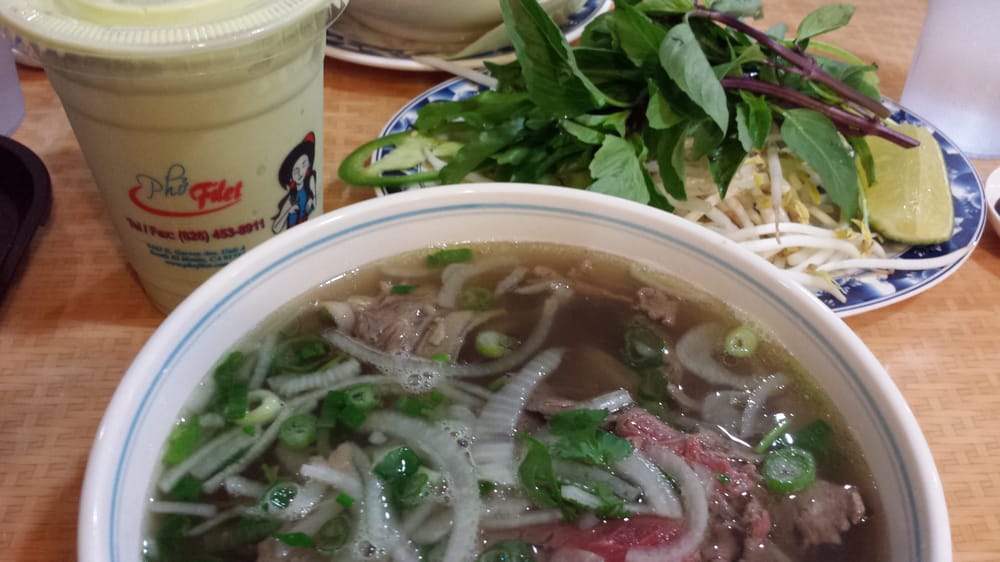
Find the location of a particular element. The height and width of the screenshot is (562, 1000). cup is located at coordinates (244, 146).